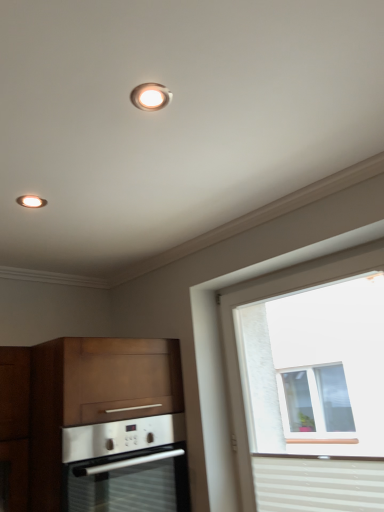
Question: Should I look upward or downward to see wooden cabinet at lower left?

Choices:
 (A) up
 (B) down

Answer: (B)

Question: Is matte white recessed light at upper center closer to camera compared to wooden cabinet at lower left?

Choices:
 (A) yes
 (B) no

Answer: (A)

Question: From the image's perspective, is matte white recessed light at upper center under wooden cabinet at lower left?

Choices:
 (A) yes
 (B) no

Answer: (B)

Question: Is matte white recessed light at upper center positioned with its back to wooden cabinet at lower left?

Choices:
 (A) yes
 (B) no

Answer: (B)

Question: From the image's perspective, is matte white recessed light at upper center on wooden cabinet at lower left?

Choices:
 (A) no
 (B) yes

Answer: (B)

Question: Is matte white recessed light at upper center to the left of wooden cabinet at lower left from the viewer's perspective?

Choices:
 (A) no
 (B) yes

Answer: (A)

Question: Considering the relative sizes of matte white recessed light at upper center and wooden cabinet at lower left in the image provided, is matte white recessed light at upper center taller than wooden cabinet at lower left?

Choices:
 (A) no
 (B) yes

Answer: (A)

Question: Can matte white recessed light at upper center be found inside white textured window at right?

Choices:
 (A) no
 (B) yes

Answer: (A)

Question: Would you say white textured window at right is a long distance from matte white recessed light at upper center?

Choices:
 (A) yes
 (B) no

Answer: (A)

Question: Does white textured window at right have a larger size compared to matte white recessed light at upper center?

Choices:
 (A) no
 (B) yes

Answer: (B)

Question: Considering the relative positions of white textured window at right and matte white recessed light at upper center in the image provided, is white textured window at right in front of matte white recessed light at upper center?

Choices:
 (A) yes
 (B) no

Answer: (B)

Question: From a real-world perspective, is white textured window at right positioned under matte white recessed light at upper center based on gravity?

Choices:
 (A) no
 (B) yes

Answer: (B)

Question: Can you confirm if white textured window at right is taller than matte white recessed light at upper center?

Choices:
 (A) yes
 (B) no

Answer: (A)

Question: From a real-world perspective, is matte white recessed light at upper center on white striped curtain at lower right?

Choices:
 (A) no
 (B) yes

Answer: (B)